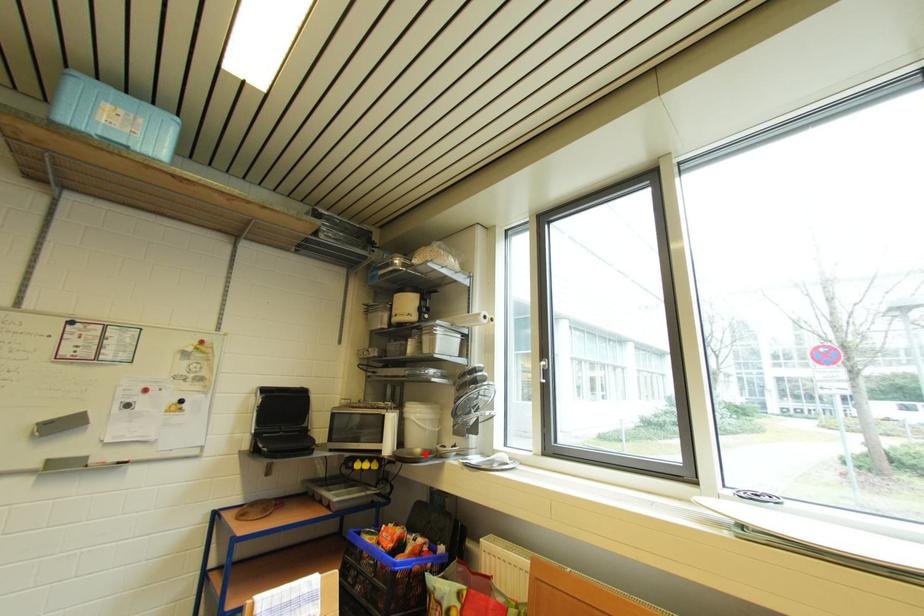
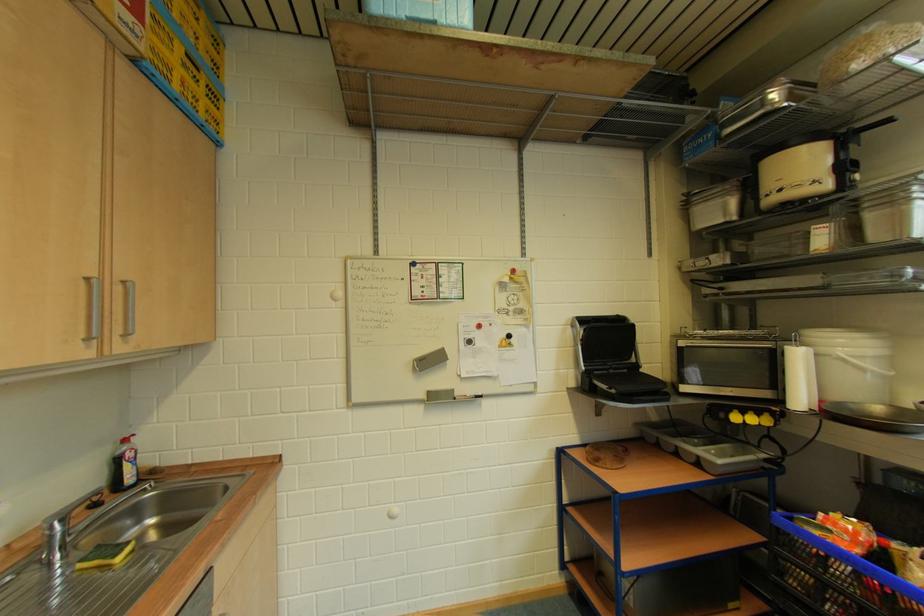
Question: I am providing you with two images of the same scene from different viewpoints. Given a red point in image1, look at the same physical point in image2. Is it:

Choices:
 (A) Closer to the viewpoint
 (B) Farther from the viewpoint

Answer: (A)